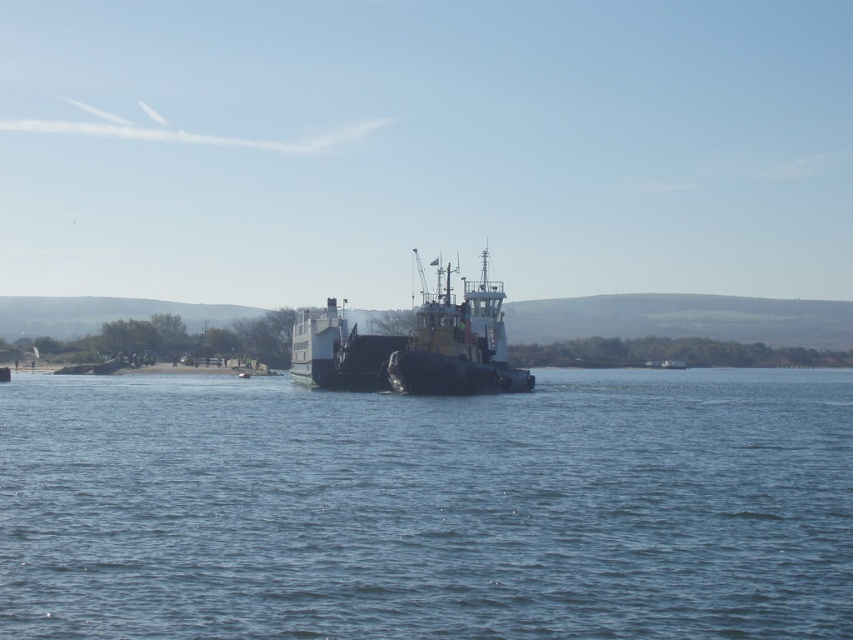
You are a passenger on the ferry and want to take a photo of the black matte tugboat at center and the blue water at center. Which object is positioned lower in the image?

The blue water at center is located below the black matte tugboat at center, so the blue water at center is positioned lower in the image.